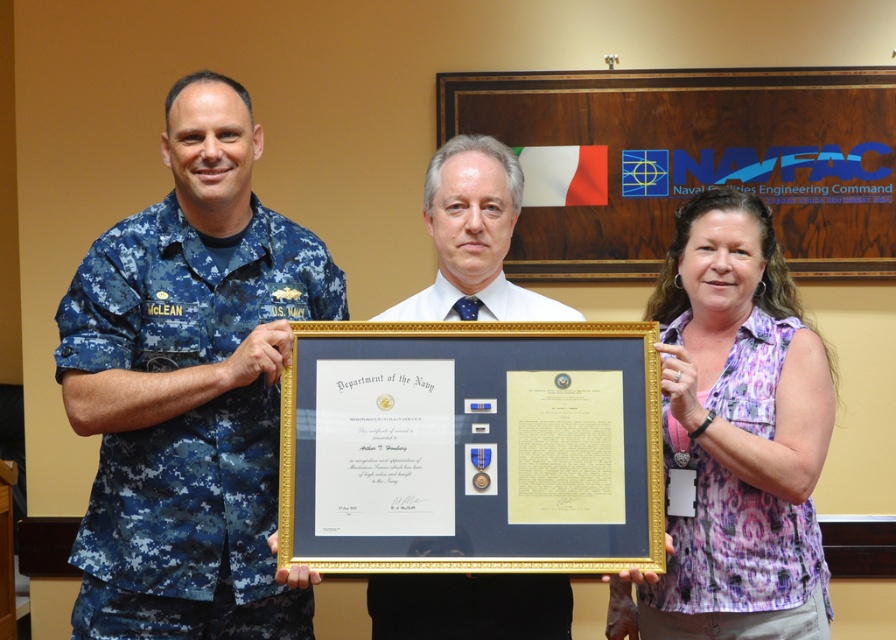
Does digital camouflage uniform at left have a lesser width compared to blue fabric uniform at center?

Incorrect, digital camouflage uniform at left's width is not less than blue fabric uniform at center's.

Is digital camouflage uniform at left shorter than blue fabric uniform at center?

No, digital camouflage uniform at left is not shorter than blue fabric uniform at center.

Which is in front, point (179, 385) or point (489, 307)?

Positioned in front is point (179, 385).

Image resolution: width=896 pixels, height=640 pixels. Find the location of `digital camouflage uniform at left`. digital camouflage uniform at left is located at coordinates (185, 420).

Is purple printed shirt at center taller than white matte framed certificate at center?

Correct, purple printed shirt at center is much taller as white matte framed certificate at center.

Identify the location of purple printed shirt at center. The image size is (896, 640). (738, 433).

Locate an element on the screen. purple printed shirt at center is located at coordinates (738, 433).

Is white matte framed certificate at center bigger than blue fabric uniform at center?

Correct, white matte framed certificate at center is larger in size than blue fabric uniform at center.

Is point (444, 624) closer to viewer compared to point (436, 637)?

That is True.

Find the location of a particular element. This screenshot has height=640, width=896. white matte framed certificate at center is located at coordinates (472, 237).